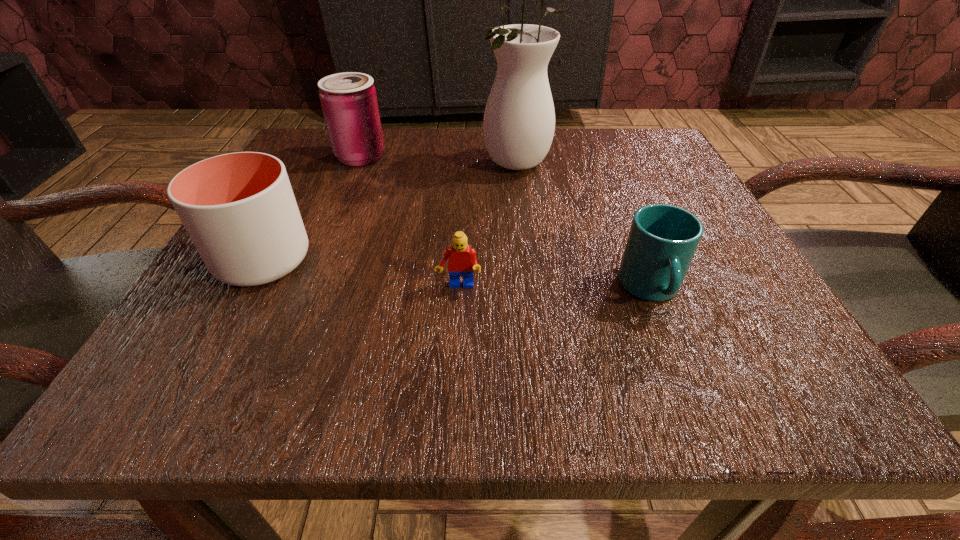
Image resolution: width=960 pixels, height=540 pixels. I want to click on free point located on the front of the taller cup, so click(x=203, y=368).

This screenshot has height=540, width=960. Find the location of `vacant position located 0.060m on the handle side of the right cup`. vacant position located 0.060m on the handle side of the right cup is located at coordinates (679, 359).

The height and width of the screenshot is (540, 960). Find the location of `free region located 0.070m on the front-facing side of the Lego`. free region located 0.070m on the front-facing side of the Lego is located at coordinates (x=456, y=336).

You are a GUI agent. You are given a task and a screenshot of the screen. Output one action in this format:
    pyautogui.click(x=<x>, y=<y>)
    Task: Click on the vase that is positioned at the far edge
    This screenshot has height=540, width=960.
    Given the screenshot: What is the action you would take?
    pyautogui.click(x=519, y=120)

Find the location of `can positioned at the far edge`. can positioned at the far edge is located at coordinates (349, 102).

The height and width of the screenshot is (540, 960). I want to click on can that is at the left edge, so click(349, 102).

Where is `cup situated at the left edge`? The image size is (960, 540). cup situated at the left edge is located at coordinates (239, 209).

Find the location of `object located in the right edge section of the desktop`. object located in the right edge section of the desktop is located at coordinates (662, 241).

The image size is (960, 540). I want to click on object that is at the far left corner, so click(349, 102).

Identify the location of vacant space at the far edge of the desktop. (570, 161).